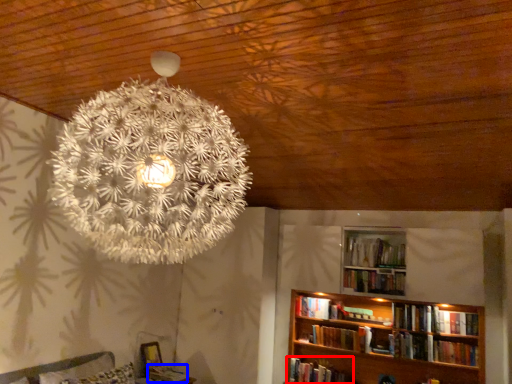
Question: Among these objects, which one is nearest to the camera, book (highlighted by a red box) or book (highlighted by a blue box)?

Choices:
 (A) book
 (B) book

Answer: (B)